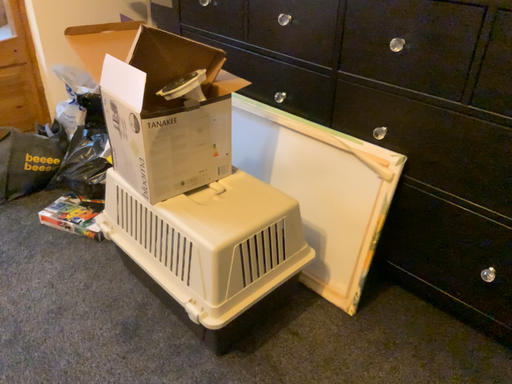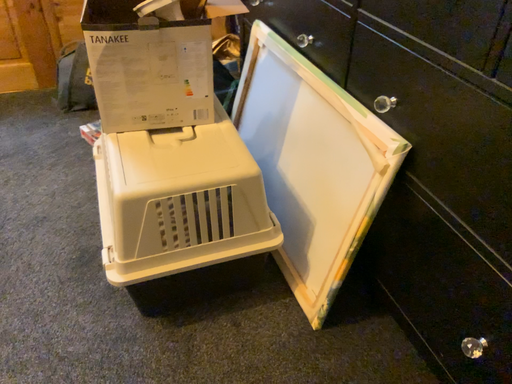
Question: How did the camera likely rotate when shooting the video?

Choices:
 (A) rotated left
 (B) rotated right

Answer: (A)